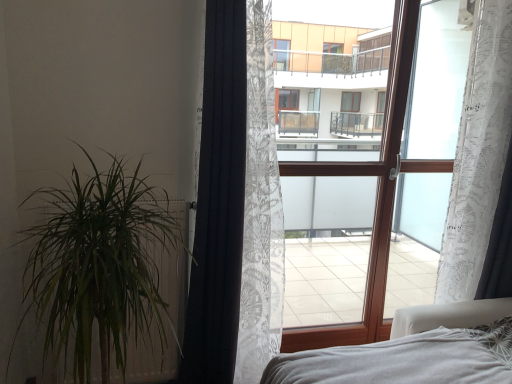
Measure the distance between transparent fabric at center and camera.

The depth of transparent fabric at center is 6.84 feet.

Identify the location of green leafy plant at left. Image resolution: width=512 pixels, height=384 pixels. (99, 267).

Measure the distance between white lace curtain at right, the 2th curtain in the left-to-right sequence, and camera.

The distance of white lace curtain at right, the 2th curtain in the left-to-right sequence, from camera is 1.97 meters.

Measure the distance between point (504, 221) and camera.

The distance of point (504, 221) from camera is 7.43 feet.

What do you see at coordinates (415, 350) in the screenshot? This screenshot has height=384, width=512. I see `white soft bed at lower right` at bounding box center [415, 350].

Describe the element at coordinates (236, 205) in the screenshot. I see `black textured curtain at left, marked as the 1th curtain in a left-to-right arrangement` at that location.

The width and height of the screenshot is (512, 384). Find the location of `transparent fabric at center`. transparent fabric at center is located at coordinates (367, 165).

Does white soft bed at lower right turn towards white lace curtain at right, which is counted as the 3th curtain, starting from the left?

No, white soft bed at lower right is not aimed at white lace curtain at right, which is counted as the 3th curtain, starting from the left.

Does point (509, 378) come closer to viewer compared to point (507, 154)?

Yes, point (509, 378) is in front of point (507, 154).

Who is bigger, white soft bed at lower right or white lace curtain at right, which is counted as the 3th curtain, starting from the left?

Bigger between the two is white soft bed at lower right.

From the picture: How many degrees apart are the facing directions of white soft bed at lower right and white lace curtain at right, which is counted as the 3th curtain, starting from the left?

white soft bed at lower right and white lace curtain at right, which is counted as the 3th curtain, starting from the left, are facing 91.4 degrees away from each other.

Considering the positions of objects white sheer curtain at right and white soft bed at lower right in the image provided, who is in front, white sheer curtain at right or white soft bed at lower right?

white soft bed at lower right.

Measure the distance between white sheer curtain at right and white soft bed at lower right.

They are 3.50 feet apart.

Identify the location of bed that is on the left side of white sheer curtain at right. (415, 350).

Are white sheer curtain at right and white soft bed at lower right located far from each other?

Yes.

How much distance is there between white lace curtain at right, the 2th curtain in the left-to-right sequence, and green leafy plant at left?

They are 5.58 feet apart.

Is white lace curtain at right, the second curtain in the right-to-left sequence, positioned with its back to green leafy plant at left?

No, white lace curtain at right, the second curtain in the right-to-left sequence, is not facing away from green leafy plant at left.

The height and width of the screenshot is (384, 512). What are the coordinates of `houseplant that is in front of the white lace curtain at right, the second curtain in the right-to-left sequence` in the screenshot? It's located at (99, 267).

Does point (488, 198) come in front of point (87, 331)?

No, it is behind (87, 331).

Is green leafy plant at left oriented away from white soft bed at lower right?

No.

From the picture: From the image's perspective, which object appears higher, green leafy plant at left or white soft bed at lower right?

green leafy plant at left is shown above in the image.

Image resolution: width=512 pixels, height=384 pixels. Identify the location of houseplant in front of the white soft bed at lower right. (99, 267).

Is point (95, 296) closer or farther from the camera than point (349, 350)?

Point (95, 296).

Does black textured curtain at left, acting as the 3th curtain starting from the right, turn towards transparent fabric at center?

No, black textured curtain at left, acting as the 3th curtain starting from the right, is not aimed at transparent fabric at center.

Is black textured curtain at left, acting as the 3th curtain starting from the right, beside transparent fabric at center?

black textured curtain at left, acting as the 3th curtain starting from the right, and transparent fabric at center are not in contact.

Image resolution: width=512 pixels, height=384 pixels. In order to click on bay window on the right of black textured curtain at left, marked as the 1th curtain in a left-to-right arrangement in this screenshot , I will do `click(367, 165)`.

Considering their positions, is black textured curtain at left, acting as the 3th curtain starting from the right, located in front of or behind transparent fabric at center?

In the image, black textured curtain at left, acting as the 3th curtain starting from the right, appears in front of transparent fabric at center.

Consider the image. Is green leafy plant at left next to white lace curtain at right, the 1th curtain positioned from the right?

No.

In terms of size, does green leafy plant at left appear bigger or smaller than white lace curtain at right, which is counted as the 3th curtain, starting from the left?

In the image, green leafy plant at left appears to be larger than white lace curtain at right, which is counted as the 3th curtain, starting from the left.

Considering the relative sizes of green leafy plant at left and white lace curtain at right, the 1th curtain positioned from the right, in the image provided, is green leafy plant at left shorter than white lace curtain at right, the 1th curtain positioned from the right,?

No, green leafy plant at left is not shorter than white lace curtain at right, the 1th curtain positioned from the right.

Locate an element on the screen. The height and width of the screenshot is (384, 512). the 2nd curtain positioned above the green leafy plant at left (from a real-world perspective) is located at coordinates (499, 243).

Is point (496, 230) farther from viewer compared to point (210, 321)?

Yes, it is.

I want to click on the 2nd curtain to the right of the black textured curtain at left, marked as the 1th curtain in a left-to-right arrangement, counting from the anchor's position, so click(499, 243).

Which of these two, white lace curtain at right, which is counted as the 3th curtain, starting from the left, or black textured curtain at left, acting as the 3th curtain starting from the right, is wider?

black textured curtain at left, acting as the 3th curtain starting from the right.

Is white lace curtain at right, the 1th curtain positioned from the right, far from black textured curtain at left, marked as the 1th curtain in a left-to-right arrangement?

That's right, there is a large distance between white lace curtain at right, the 1th curtain positioned from the right, and black textured curtain at left, marked as the 1th curtain in a left-to-right arrangement.

This screenshot has width=512, height=384. In order to click on the 3rd curtain behind the white soft bed at lower right in this screenshot , I will do `click(499, 243)`.

Identify the location of window screen that appears above the white soft bed at lower right (from a real-world perspective). Image resolution: width=512 pixels, height=384 pixels. (436, 83).

When comparing their distances from white sheer curtain at right, does white lace curtain at right, the 1th curtain positioned from the right, or black textured curtain at left, marked as the 1th curtain in a left-to-right arrangement, seem further?

Based on the image, black textured curtain at left, marked as the 1th curtain in a left-to-right arrangement, appears to be further to white sheer curtain at right.

Based on their spatial positions, is transparent fabric at center or white lace curtain at right, the 1th curtain positioned from the right, closer to white soft bed at lower right?

Based on the image, white lace curtain at right, the 1th curtain positioned from the right, appears to be nearer to white soft bed at lower right.

Considering their positions, is white soft bed at lower right positioned closer to green leafy plant at left than transparent fabric at center?

The object closer to green leafy plant at left is white soft bed at lower right.

Which object lies further to the anchor point white lace curtain at right, the second curtain in the right-to-left sequence, transparent fabric at center or black textured curtain at left, acting as the 3th curtain starting from the right?

black textured curtain at left, acting as the 3th curtain starting from the right.

From the picture: Which object lies nearer to the anchor point white lace curtain at right, the 1th curtain positioned from the right, green leafy plant at left or white sheer curtain at right?

The object closer to white lace curtain at right, the 1th curtain positioned from the right, is white sheer curtain at right.

Looking at the image, which one is located further to green leafy plant at left, transparent fabric at center or white lace curtain at right, which is counted as the 3th curtain, starting from the left?

Based on the image, white lace curtain at right, which is counted as the 3th curtain, starting from the left, appears to be further to green leafy plant at left.

Consider the image. Estimate the real-world distances between objects in this image. Which object is closer to transparent fabric at center, white lace curtain at right, the second curtain in the right-to-left sequence, or white soft bed at lower right?

white lace curtain at right, the second curtain in the right-to-left sequence.

Which object lies nearer to the anchor point black textured curtain at left, marked as the 1th curtain in a left-to-right arrangement, white soft bed at lower right or white lace curtain at right, the 2th curtain in the left-to-right sequence?

white soft bed at lower right lies closer to black textured curtain at left, marked as the 1th curtain in a left-to-right arrangement, than the other object.

At what (x,y) coordinates should I click in order to perform the action: click on window screen between white lace curtain at right, the second curtain in the right-to-left sequence, and white soft bed at lower right, in the vertical direction. Please return your answer as a coordinate pair (x, y). This screenshot has width=512, height=384. Looking at the image, I should click on (436, 83).

The width and height of the screenshot is (512, 384). I want to click on bay window between black textured curtain at left, marked as the 1th curtain in a left-to-right arrangement, and white sheer curtain at right from left to right, so click(x=367, y=165).

In order to click on bay window between black textured curtain at left, marked as the 1th curtain in a left-to-right arrangement, and white lace curtain at right, the 1th curtain positioned from the right in this screenshot , I will do `click(367, 165)`.

Locate an element on the screen. The width and height of the screenshot is (512, 384). curtain located between green leafy plant at left and white soft bed at lower right in the left-right direction is located at coordinates (236, 205).